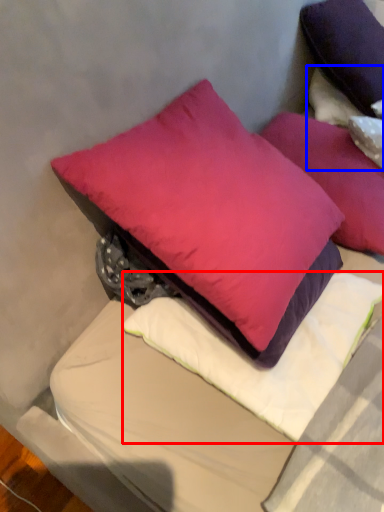
Question: Which object appears closest to the camera in this image, pillow (highlighted by a red box) or pillow (highlighted by a blue box)?

Choices:
 (A) pillow
 (B) pillow

Answer: (A)